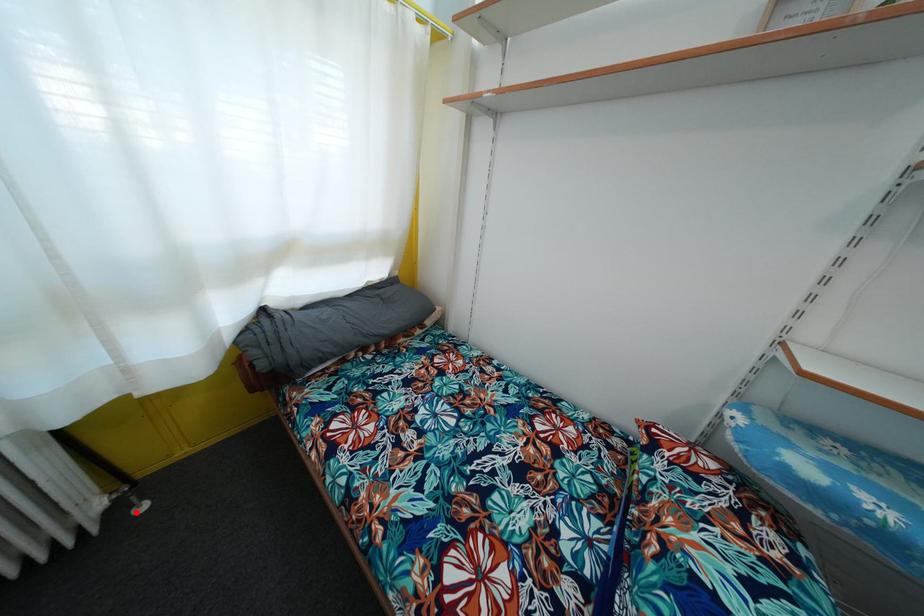
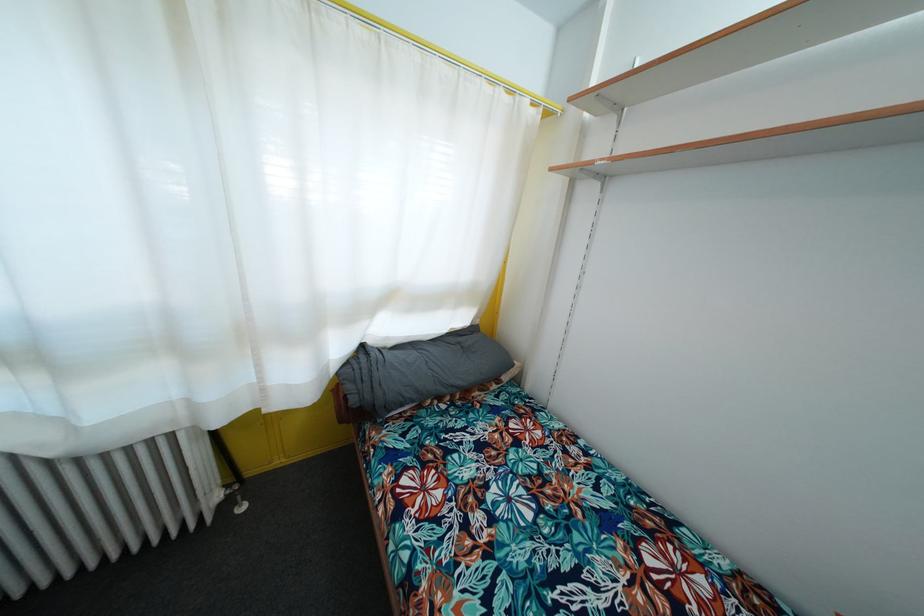
Question: I am providing you with two images of the same scene from different viewpoints. In image1, a red point is highlighted. Considering the same 3D point in image2, which of the following is correct?

Choices:
 (A) It is closer
 (B) It is farther

Answer: (A)